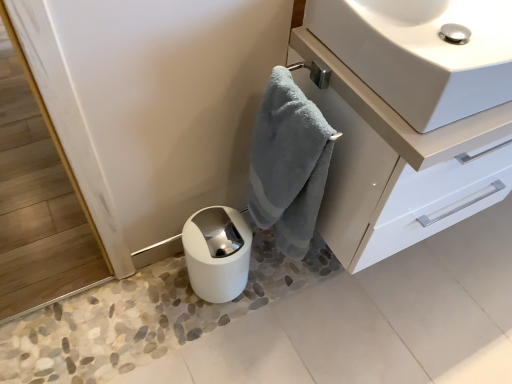
Locate an element on the screen. This screenshot has height=384, width=512. free space in front of white glossy paper towel at lower center is located at coordinates click(x=212, y=340).